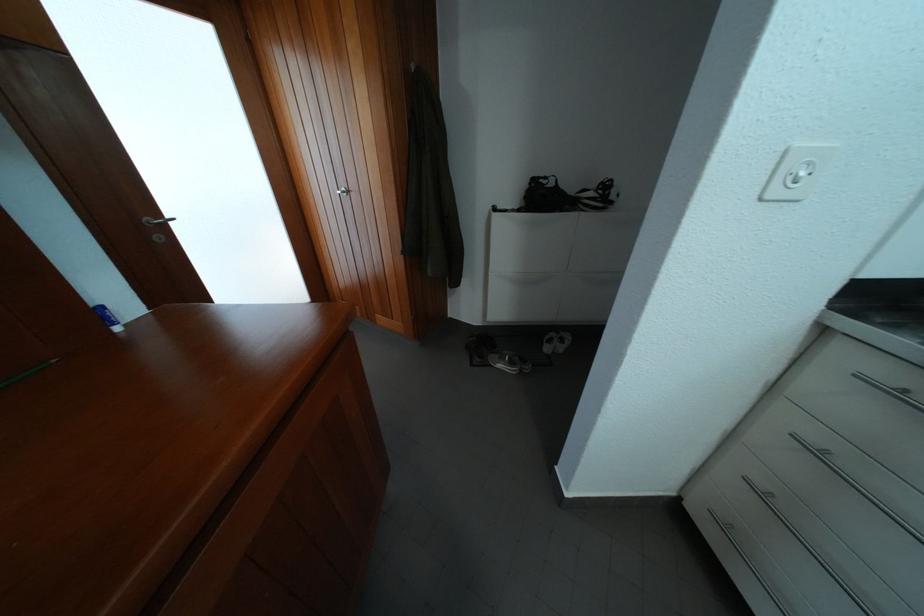
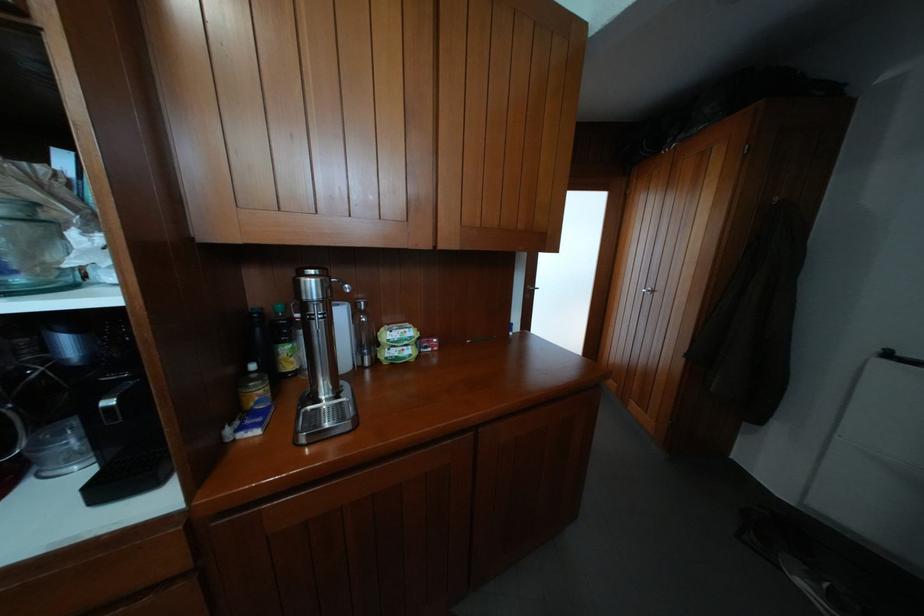
Question: The camera is either moving clockwise (left) or counter-clockwise (right) around the object. The first image is from the beginning of the video and the second image is from the end. Is the camera moving left or right when shooting the video?

Choices:
 (A) Left
 (B) Right

Answer: (B)